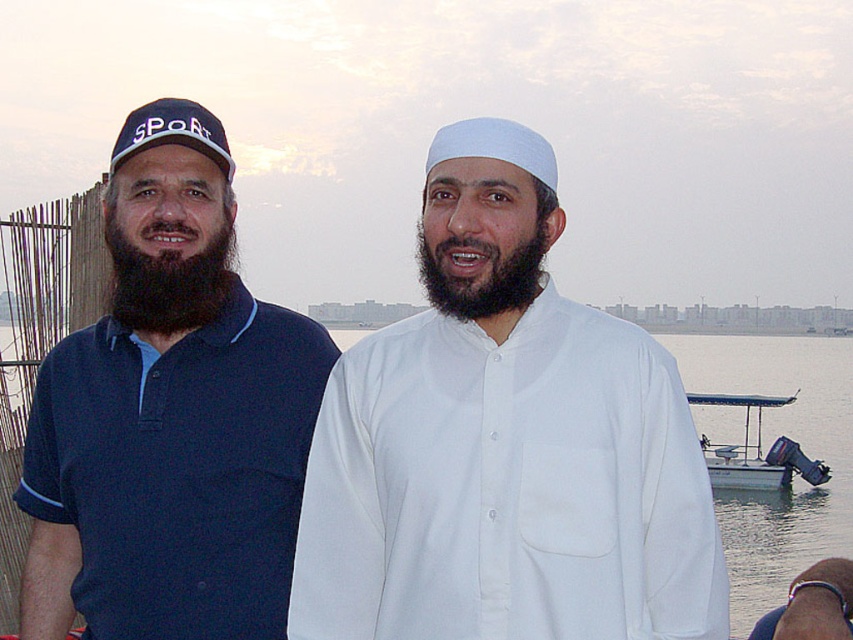
Question: Which point is farther to the camera?

Choices:
 (A) (782, 340)
 (B) (521, 259)

Answer: (A)

Question: Which point is closer to the camera taking this photo?

Choices:
 (A) (805, 548)
 (B) (117, 300)
 (C) (518, 500)
 (D) (471, 244)

Answer: (D)

Question: Can you confirm if dark brown fuzzy beard at left is positioned to the right of matte blue baseball cap at left?

Choices:
 (A) yes
 (B) no

Answer: (A)

Question: Can you confirm if matte blue polo shirt at left is positioned below dark brown fuzzy beard at left?

Choices:
 (A) no
 (B) yes

Answer: (A)

Question: Is white matte shirt at center to the left of white matte water at center from the viewer's perspective?

Choices:
 (A) yes
 (B) no

Answer: (A)

Question: Which point is closer to the camera taking this photo?

Choices:
 (A) (103, 227)
 (B) (509, 288)

Answer: (B)